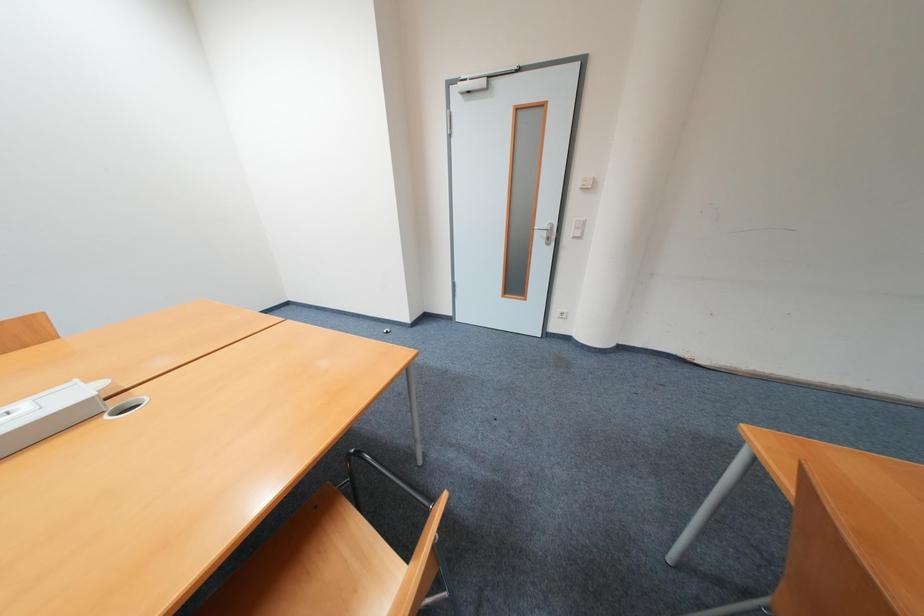
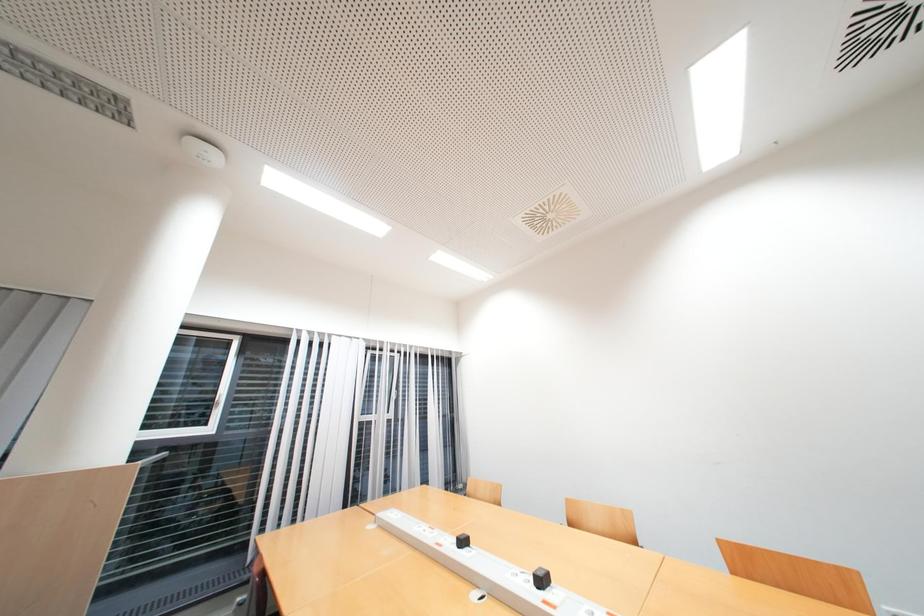
Question: The camera is either moving clockwise (left) or counter-clockwise (right) around the object. The first image is from the beginning of the video and the second image is from the end. Is the camera moving left or right when shooting the video?

Choices:
 (A) Left
 (B) Right

Answer: (B)